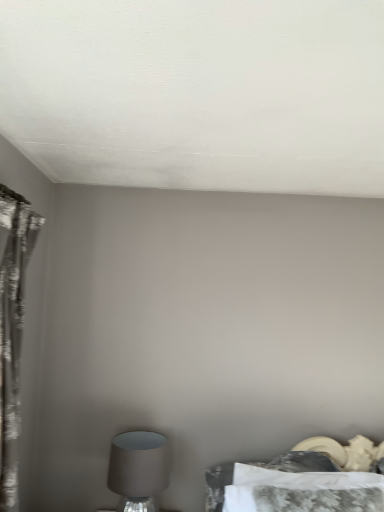
In order to click on silvery textured curtain at left in this screenshot , I will do `click(12, 329)`.

Is camouflage-patterned bed at lower right located outside silvery textured curtain at left?

camouflage-patterned bed at lower right is positioned outside silvery textured curtain at left.

Does camouflage-patterned bed at lower right have a lesser width compared to silvery textured curtain at left?

No.

Between camouflage-patterned bed at lower right and silvery textured curtain at left, which one has smaller size?

With smaller size is camouflage-patterned bed at lower right.

Find the location of a particular element. This screenshot has width=384, height=512. bed on the right of silvery textured curtain at left is located at coordinates (300, 481).

Consider the image. From a real-world perspective, which is physically above, silvery textured curtain at left or camouflage-patterned bed at lower right?

silvery textured curtain at left is physically above.

How different are the orientations of silvery textured curtain at left and camouflage-patterned bed at lower right in degrees?

82.1 degrees.

Is silvery textured curtain at left facing away from camouflage-patterned bed at lower right?

silvery textured curtain at left is not turned away from camouflage-patterned bed at lower right.

Consider the image. Which object is wider, matte gray lampshade at lower left or camouflage-patterned bed at lower right?

Wider between the two is matte gray lampshade at lower left.

Would you consider matte gray lampshade at lower left to be distant from camouflage-patterned bed at lower right?

matte gray lampshade at lower left is near camouflage-patterned bed at lower right, not far away.

Between matte gray lampshade at lower left and camouflage-patterned bed at lower right, which one has more height?

matte gray lampshade at lower left.

Could camouflage-patterned bed at lower right be considered to be inside matte gray lampshade at lower left?

That's incorrect, camouflage-patterned bed at lower right is not inside matte gray lampshade at lower left.

From the image's perspective, is matte gray lampshade at lower left under silvery textured curtain at left?

Indeed, from the image's perspective, matte gray lampshade at lower left is shown beneath silvery textured curtain at left.

I want to click on table lamp that is under the silvery textured curtain at left (from a real-world perspective), so pos(138,469).

How different are the orientations of matte gray lampshade at lower left and silvery textured curtain at left in degrees?

matte gray lampshade at lower left and silvery textured curtain at left are facing 88.9 degrees away from each other.

Which of these two, silvery textured curtain at left or matte gray lampshade at lower left, stands shorter?

matte gray lampshade at lower left is shorter.

Between silvery textured curtain at left and matte gray lampshade at lower left, which one has smaller width?

silvery textured curtain at left.

Looking at this image, is silvery textured curtain at left looking in the opposite direction of matte gray lampshade at lower left?

No.

Is silvery textured curtain at left smaller than matte gray lampshade at lower left?

No, silvery textured curtain at left is not smaller than matte gray lampshade at lower left.

Which is farther, (338, 469) or (127, 494)?

The point (338, 469) is more distant.

Based on the photo, from the image's perspective, is camouflage-patterned bed at lower right located above or below matte gray lampshade at lower left?

Based on their image positions, camouflage-patterned bed at lower right is located above matte gray lampshade at lower left.

Can you confirm if camouflage-patterned bed at lower right is positioned to the left of matte gray lampshade at lower left?

No.

In terms of height, does camouflage-patterned bed at lower right look taller or shorter compared to matte gray lampshade at lower left?

In the image, camouflage-patterned bed at lower right appears to be shorter than matte gray lampshade at lower left.

Locate an element on the screen. The width and height of the screenshot is (384, 512). bed below the silvery textured curtain at left (from a real-world perspective) is located at coordinates (300, 481).

I want to click on bed below the silvery textured curtain at left (from the image's perspective), so click(300, 481).

When comparing their distances from camouflage-patterned bed at lower right, does matte gray lampshade at lower left or silvery textured curtain at left seem further?

silvery textured curtain at left.

Estimate the real-world distances between objects in this image. Which object is further from matte gray lampshade at lower left, silvery textured curtain at left or camouflage-patterned bed at lower right?

Based on the image, silvery textured curtain at left appears to be further to matte gray lampshade at lower left.

When comparing their distances from camouflage-patterned bed at lower right, does silvery textured curtain at left or matte gray lampshade at lower left seem closer?

matte gray lampshade at lower left is positioned closer to the anchor camouflage-patterned bed at lower right.

Which object lies further to the anchor point silvery textured curtain at left, camouflage-patterned bed at lower right or matte gray lampshade at lower left?

camouflage-patterned bed at lower right.

From the image, which object appears to be nearer to silvery textured curtain at left, matte gray lampshade at lower left or camouflage-patterned bed at lower right?

Among the two, matte gray lampshade at lower left is located nearer to silvery textured curtain at left.

Based on their spatial positions, is camouflage-patterned bed at lower right or silvery textured curtain at left closer to matte gray lampshade at lower left?

camouflage-patterned bed at lower right lies closer to matte gray lampshade at lower left than the other object.

You are a GUI agent. You are given a task and a screenshot of the screen. Output one action in this format:
    pyautogui.click(x=<x>, y=<y>)
    Task: Click on the table lamp between silvery textured curtain at left and camouflage-patterned bed at lower right in the horizontal direction
    Image resolution: width=384 pixels, height=512 pixels.
    Given the screenshot: What is the action you would take?
    pyautogui.click(x=138, y=469)